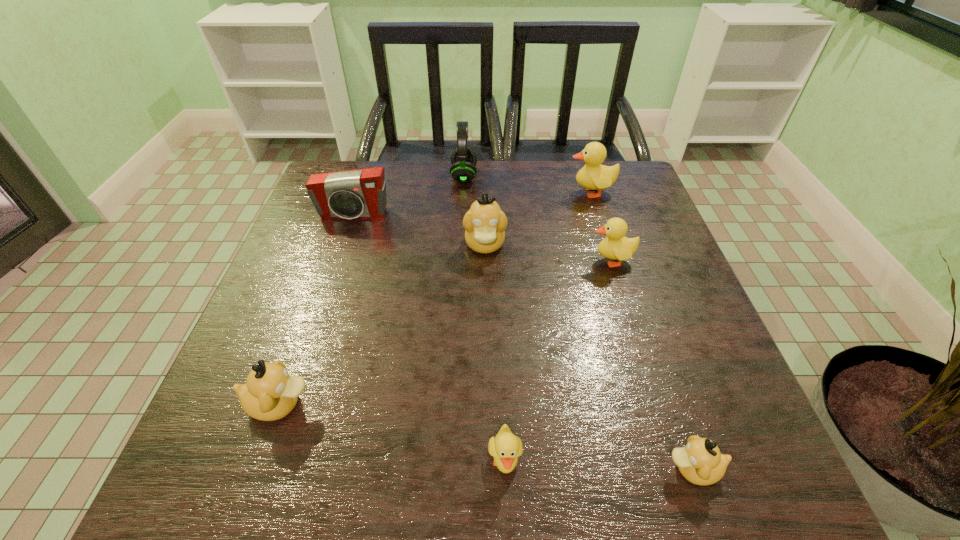
At what (x,y) coordinates should I click in order to perform the action: click on empty location between the fourth farthest duckling and the smallest yellow duckling. Please return your answer as a coordinate pair (x, y). Image resolution: width=960 pixels, height=540 pixels. Looking at the image, I should click on (393, 433).

This screenshot has width=960, height=540. Find the location of `free space between the rightmost tan duckling and the biggest tan duckling`. free space between the rightmost tan duckling and the biggest tan duckling is located at coordinates (588, 357).

What are the coordinates of `free space that is in between the third farthest object and the biggest tan duckling` in the screenshot? It's located at (419, 230).

The height and width of the screenshot is (540, 960). Identify the location of unoccupied position between the second nearest yellow duckling and the second biggest tan duckling. (445, 332).

You are a GUI agent. You are given a task and a screenshot of the screen. Output one action in this format:
    pyautogui.click(x=<x>, y=<y>)
    Task: Click on the free space between the second farthest tan duckling and the leftmost yellow duckling
    This screenshot has width=960, height=540.
    Given the screenshot: What is the action you would take?
    pyautogui.click(x=393, y=433)

Where is `vacant point located between the black headset and the second smallest yellow duckling`? The height and width of the screenshot is (540, 960). vacant point located between the black headset and the second smallest yellow duckling is located at coordinates (538, 218).

The height and width of the screenshot is (540, 960). Find the location of `free space between the second tan duckling from right to left and the smallest tan duckling`. free space between the second tan duckling from right to left and the smallest tan duckling is located at coordinates (588, 357).

You are a GUI agent. You are given a task and a screenshot of the screen. Output one action in this format:
    pyautogui.click(x=<x>, y=<y>)
    Task: Click on the free space between the camera and the farthest tan duckling
    
    Given the screenshot: What is the action you would take?
    pyautogui.click(x=419, y=230)

Find the location of a particular element. This screenshot has width=960, height=540. free space between the smallest yellow duckling and the second tan duckling from left to right is located at coordinates (495, 353).

Where is `vacant area that lies between the headset and the leftmost yellow duckling`? The width and height of the screenshot is (960, 540). vacant area that lies between the headset and the leftmost yellow duckling is located at coordinates (485, 319).